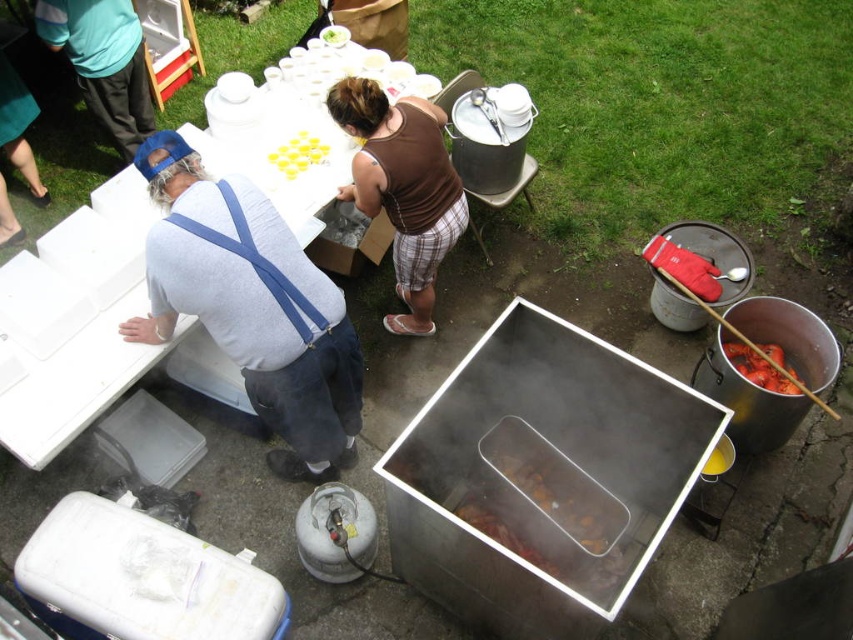
Consider the image. Is white plastic table at upper left above yellow plastic cups at upper center?

Yes, white plastic table at upper left is above yellow plastic cups at upper center.

Consider the image. Which of these two, white plastic table at upper left or yellow plastic cups at upper center, stands taller?

With more height is white plastic table at upper left.

This screenshot has height=640, width=853. Find the location of `white plastic table at upper left`. white plastic table at upper left is located at coordinates (73, 321).

Does gray cotton shirt at upper left lie in front of shiny silver lobster at right?

Yes, it is.

Who is more forward, (202, 262) or (738, 348)?

Point (202, 262)

This screenshot has width=853, height=640. Find the location of `gray cotton shirt at upper left`. gray cotton shirt at upper left is located at coordinates (252, 307).

Does brown cotton tank top at center appear under yellow plastic cups at upper center?

Yes.

Who is taller, brown cotton tank top at center or yellow plastic cups at upper center?

Standing taller between the two is brown cotton tank top at center.

The height and width of the screenshot is (640, 853). What are the coordinates of `brown cotton tank top at center` in the screenshot? It's located at (402, 188).